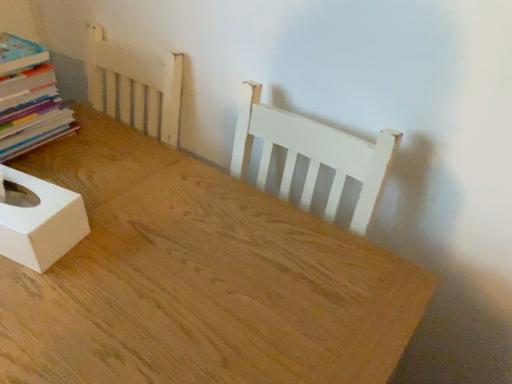
Find the location of `unoccupied region to the right of white matte tissue box at lower left`. unoccupied region to the right of white matte tissue box at lower left is located at coordinates (x=120, y=236).